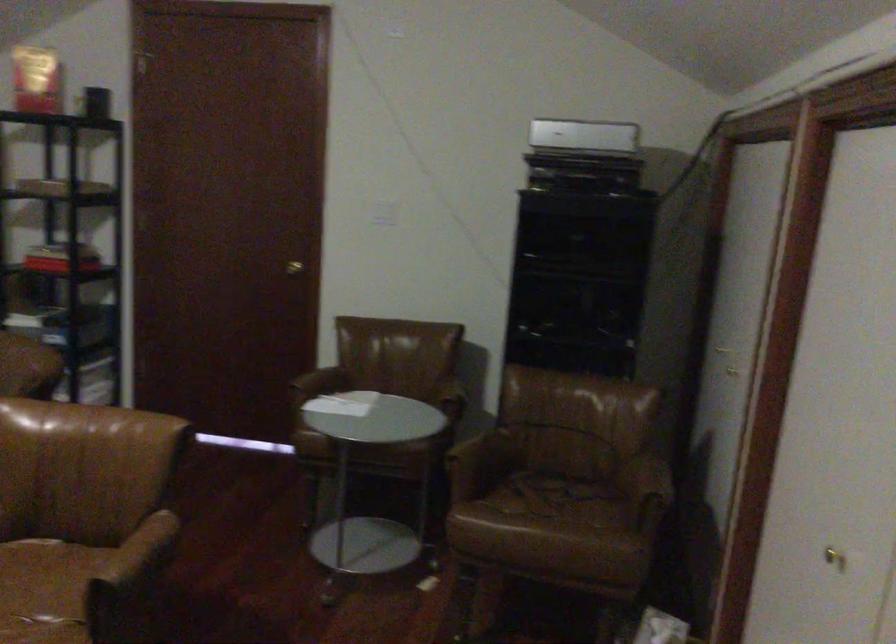
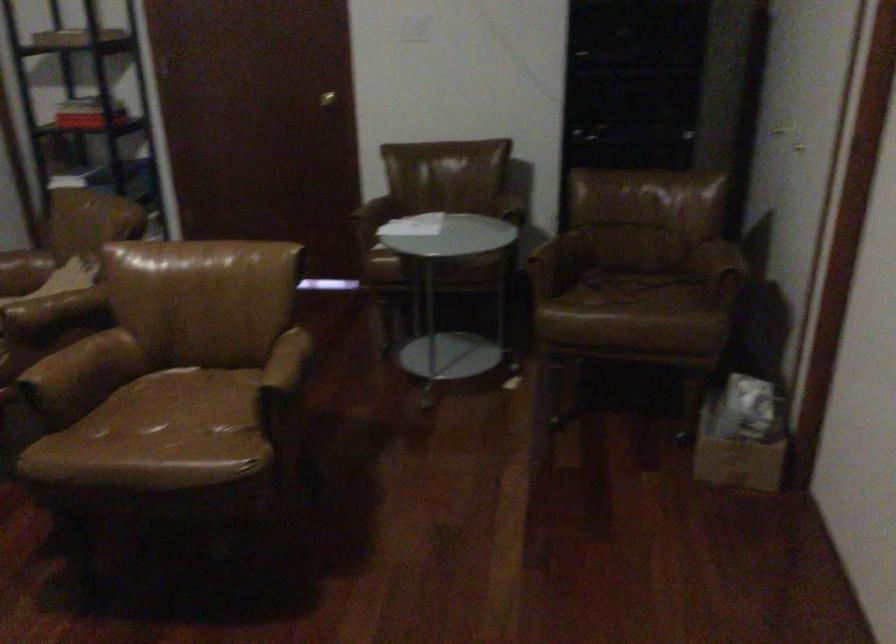
Locate, in the second image, the point that corresponds to point 134,556 in the first image.

(283, 371)